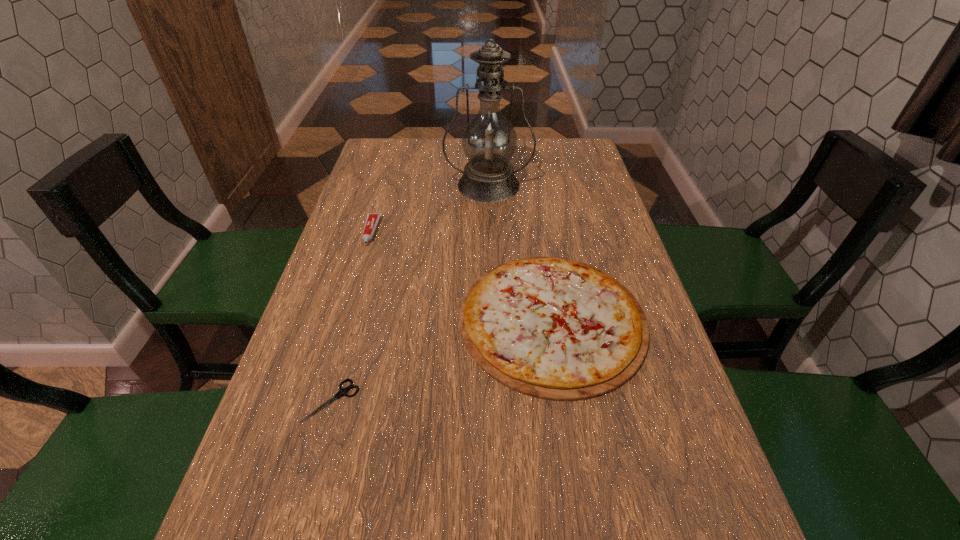
Find the location of a particular element. Image resolution: width=960 pixels, height=540 pixels. blank space that satisfies the following two spatial constraints: 1. at the nozzle of the toothpaste; 2. on the left side of the shortest object is located at coordinates (321, 401).

Locate an element on the screen. The image size is (960, 540). free spot that satisfies the following two spatial constraints: 1. at the nozzle of the pizza; 2. on the left side of the toothpaste is located at coordinates (345, 320).

At what (x,y) coordinates should I click in order to perform the action: click on free space that satisfies the following two spatial constraints: 1. at the nozzle of the third nearest object; 2. on the right side of the pizza. Please return your answer as a coordinate pair (x, y). This screenshot has height=540, width=960. Looking at the image, I should click on [345, 320].